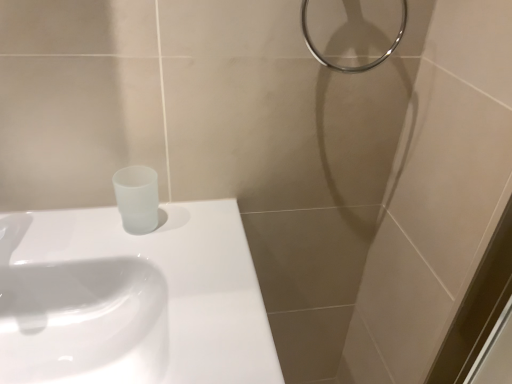
Question: From a real-world perspective, relative to white glossy sink at lower left, positioned as the 2th sink in bottom-to-top order, is white glossy sink at upper left, the 1th sink when ordered from bottom to top, vertically above or below?

Choices:
 (A) below
 (B) above

Answer: (A)

Question: Is white glossy sink at upper left, acting as the 2th sink starting from the top, wider or thinner than white glossy sink at lower left, marked as the first sink in a top-to-bottom arrangement?

Choices:
 (A) wide
 (B) thin

Answer: (B)

Question: Which is nearer to the white glossy sink at lower left, positioned as the 2th sink in bottom-to-top order?

Choices:
 (A) white glossy sink at upper left, the 1th sink when ordered from bottom to top
 (B) metallic ring at upper right

Answer: (A)

Question: Considering the real-world distances, which object is closest to the metallic ring at upper right?

Choices:
 (A) white glossy sink at lower left, marked as the first sink in a top-to-bottom arrangement
 (B) white glossy sink at upper left, acting as the 2th sink starting from the top

Answer: (A)